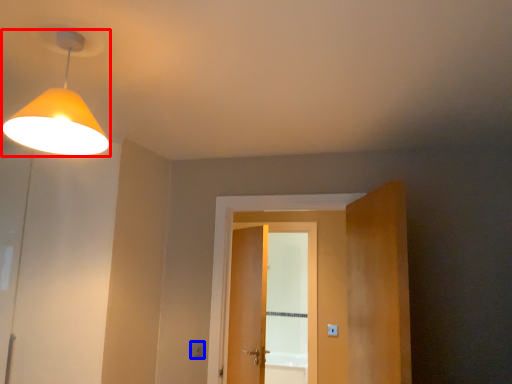
Question: Which of the following is the closest to the observer, lamp (highlighted by a red box) or light switch (highlighted by a blue box)?

Choices:
 (A) lamp
 (B) light switch

Answer: (A)